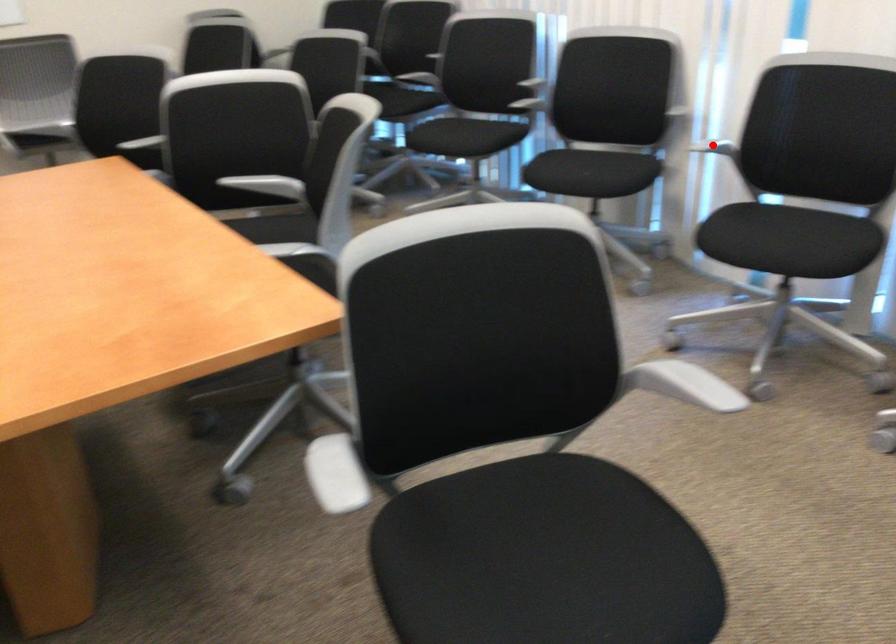
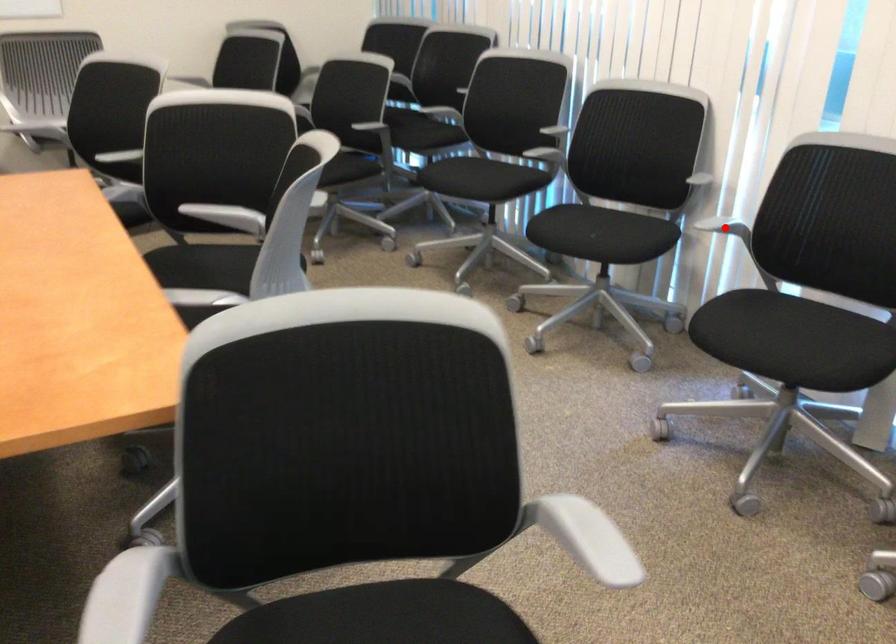
I am providing you with two images of the same scene from different viewpoints. A red point is marked on the first image and another point is marked on the second image. Do the highlighted points in image1 and image2 indicate the same real-world spot?

Yes